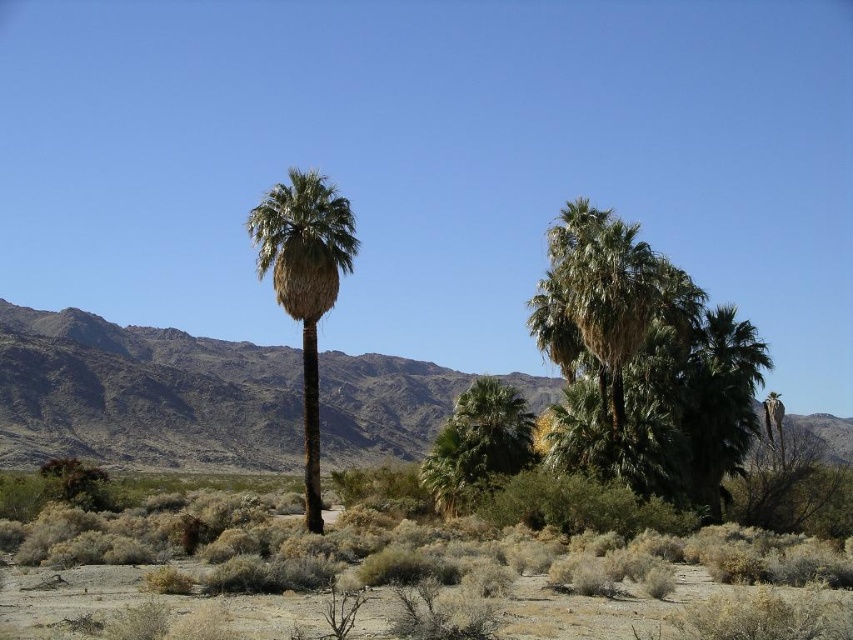
Does dry shrubbery at lower center have a lesser width compared to brown rocky mountain at center?

Yes, dry shrubbery at lower center is thinner than brown rocky mountain at center.

Is the position of dry shrubbery at lower center less distant than that of brown rocky mountain at center?

Yes, dry shrubbery at lower center is in front of brown rocky mountain at center.

Measure the distance between dry shrubbery at lower center and camera.

dry shrubbery at lower center is 30.41 feet from camera.

The width and height of the screenshot is (853, 640). Find the location of `dry shrubbery at lower center`. dry shrubbery at lower center is located at coordinates (415, 580).

Does green leafy palm tree at center have a greater height compared to green leafy palm at center?

No, green leafy palm tree at center is not taller than green leafy palm at center.

Identify the location of green leafy palm tree at center. The width and height of the screenshot is (853, 640). (x=607, y=340).

Who is higher up, dry shrubbery at lower center or green leafy palm at center?

Positioned higher is dry shrubbery at lower center.

Is dry shrubbery at lower center above green leafy palm at center?

Yes.

Is point (257, 540) closer to viewer compared to point (317, 464)?

That is True.

At what (x,y) coordinates should I click in order to perform the action: click on dry shrubbery at lower center. Please return your answer as a coordinate pair (x, y). The width and height of the screenshot is (853, 640). Looking at the image, I should click on (415, 580).